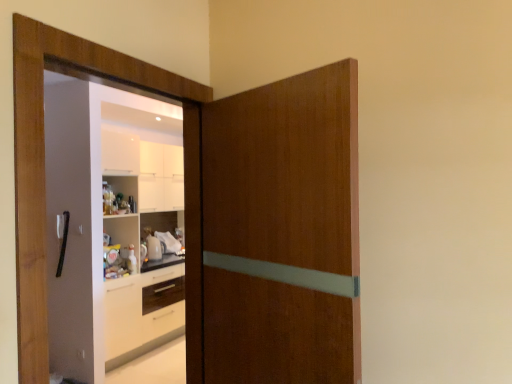
Question: Relative to wooden door at center, is wooden screen door at left in front or behind?

Choices:
 (A) front
 (B) behind

Answer: (A)

Question: From the image's perspective, is wooden screen door at left positioned above or below wooden door at center?

Choices:
 (A) above
 (B) below

Answer: (A)

Question: Which is nearer to the wooden screen door at left?

Choices:
 (A) black plastic door handle at left
 (B) wooden door at center

Answer: (A)

Question: Estimate the real-world distances between objects in this image. Which object is closer to the wooden screen door at left?

Choices:
 (A) black plastic door handle at left
 (B) wooden door at center

Answer: (A)